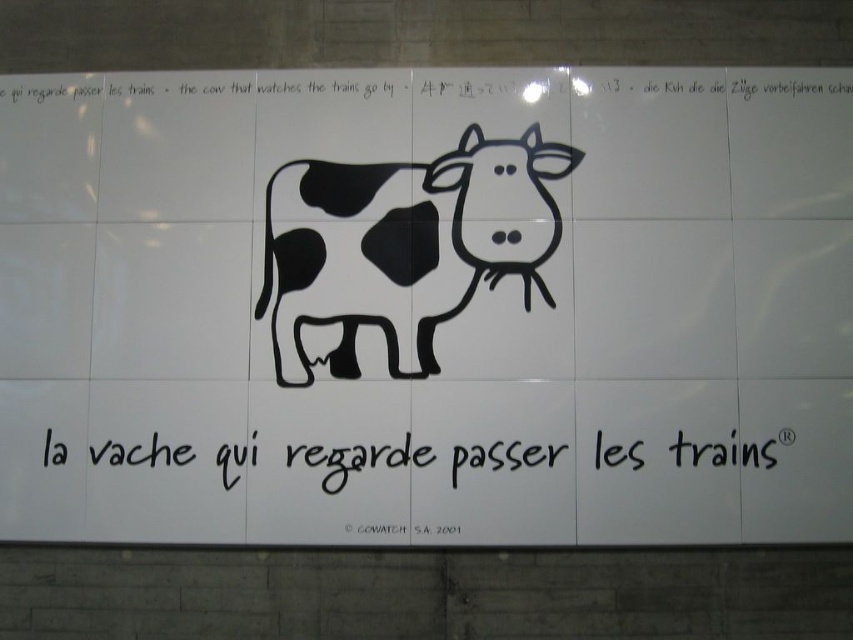
Question: Which of the following is the farthest from the observer?

Choices:
 (A) black ink writing at center
 (B) black matte cow at center

Answer: (B)

Question: Which object appears farthest from the camera in this image?

Choices:
 (A) black matte cow at center
 (B) black ink writing at center

Answer: (A)

Question: Does black matte cow at center appear under black ink writing at center?

Choices:
 (A) yes
 (B) no

Answer: (B)

Question: Which object appears closest to the camera in this image?

Choices:
 (A) black matte cow at center
 (B) black ink writing at center

Answer: (B)

Question: Does black matte cow at center come behind black ink writing at center?

Choices:
 (A) yes
 (B) no

Answer: (A)

Question: Can you confirm if black matte cow at center is thinner than black ink writing at center?

Choices:
 (A) yes
 (B) no

Answer: (A)